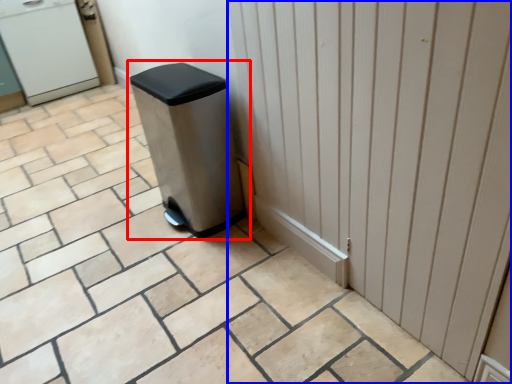
Question: Among these objects, which one is farthest to the camera, waste container (highlighted by a red box) or door (highlighted by a blue box)?

Choices:
 (A) waste container
 (B) door

Answer: (A)